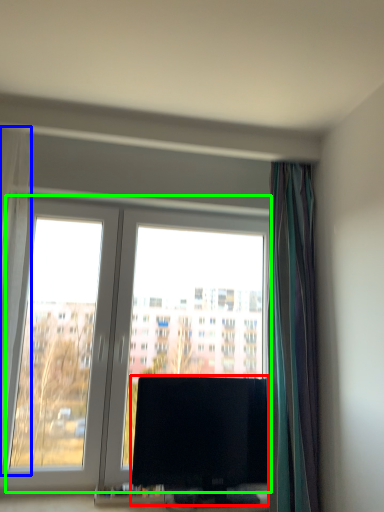
Question: Based on their relative distances, which object is nearer to television (highlighted by a red box)? Choose from curtain (highlighted by a blue box) and window (highlighted by a green box).

Choices:
 (A) curtain
 (B) window

Answer: (B)